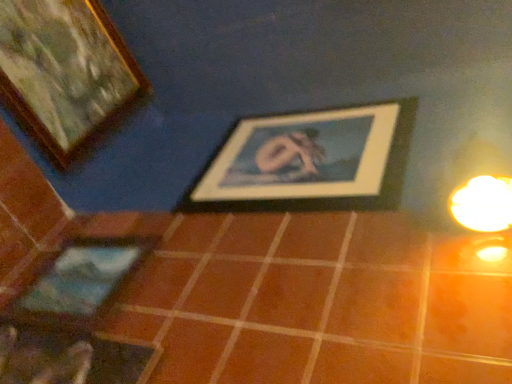
At what (x,y) coordinates should I click in order to perform the action: click on free point above brown matte tile at center (from a real-world perspective). Please return your answer as a coordinate pair (x, y). The height and width of the screenshot is (384, 512). Looking at the image, I should click on (329, 198).